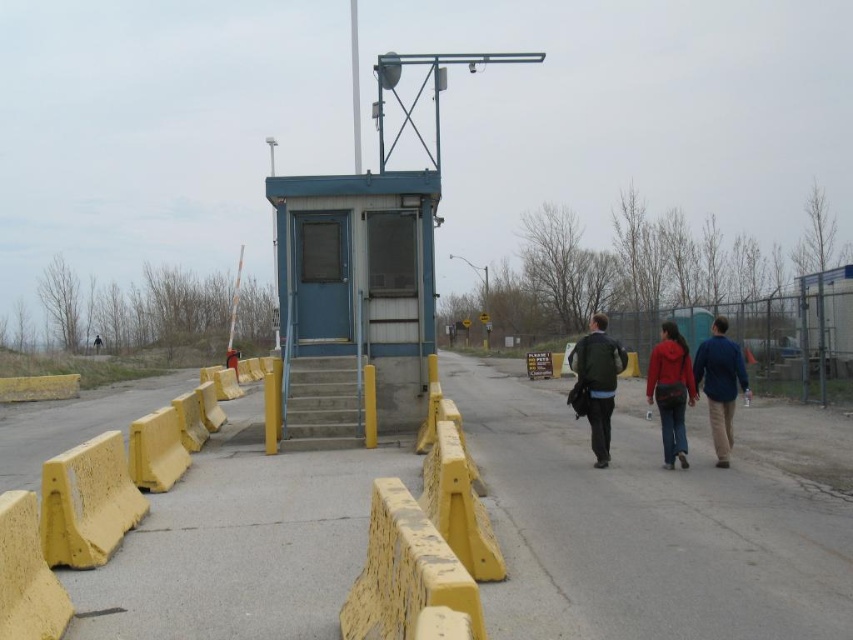
Question: Which of the following is the closest to the observer?

Choices:
 (A) (822, 582)
 (B) (647, 400)
 (C) (421, 172)

Answer: (A)

Question: Does yellow concrete stairs at center have a larger size compared to matte red hoodie at center?

Choices:
 (A) no
 (B) yes

Answer: (B)

Question: Among these points, which one is farthest from the camera?

Choices:
 (A) (407, 301)
 (B) (599, 429)
 (C) (331, 385)
 (D) (733, 348)

Answer: (A)

Question: Which of these objects is positioned closest to the matte red hoodie at center?

Choices:
 (A) dark green jacket at center
 (B) gray asphalt road at center
 (C) yellow concrete stairs at center

Answer: (B)

Question: Is dark green jacket at center below blue fabric jacket at right?

Choices:
 (A) yes
 (B) no

Answer: (A)

Question: Does yellow concrete stairs at center appear on the left side of blue fabric jacket at right?

Choices:
 (A) yes
 (B) no

Answer: (A)